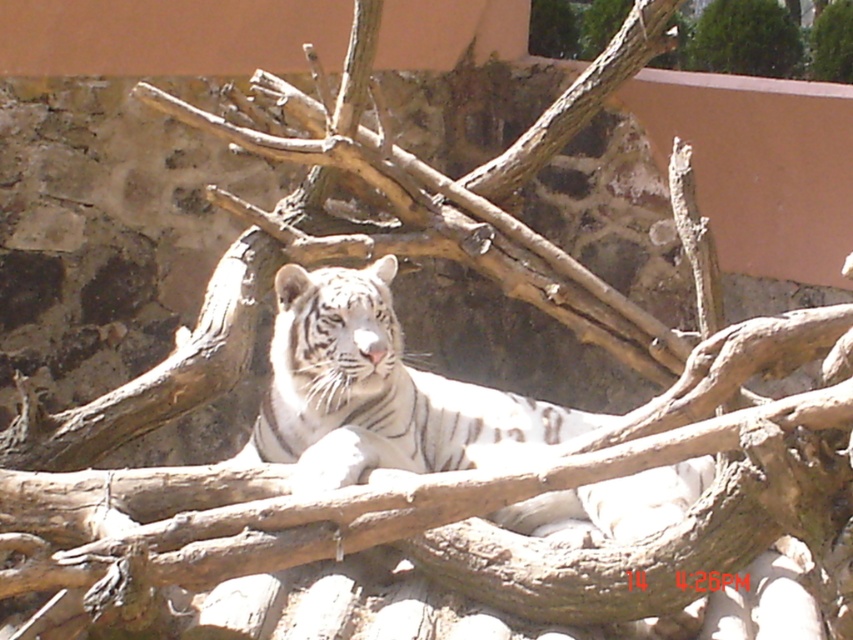
Question: Is white striped tiger at center to the left of green leafy tree at upper right from the viewer's perspective?

Choices:
 (A) no
 (B) yes

Answer: (B)

Question: Which object is farther from the camera taking this photo?

Choices:
 (A) green leafy tree at upper right
 (B) white striped tiger at center

Answer: (A)

Question: Is white striped tiger at center below green leafy tree at upper right?

Choices:
 (A) no
 (B) yes

Answer: (B)

Question: In this image, where is white striped tiger at center located relative to green leafy tree at upper right?

Choices:
 (A) below
 (B) above

Answer: (A)

Question: Which point is closer to the camera?

Choices:
 (A) green leafy tree at upper right
 (B) white striped tiger at center

Answer: (B)